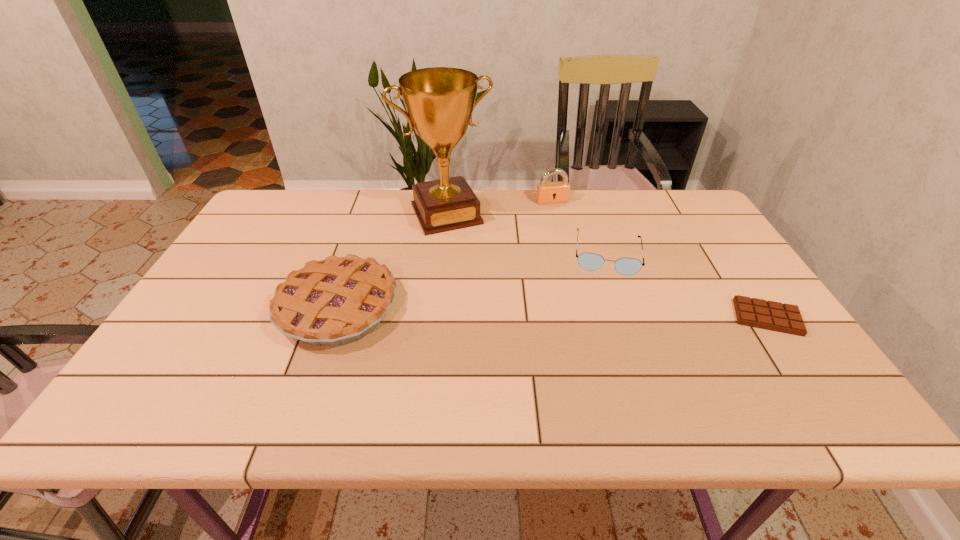
Locate an element on the screen. free spot on the desktop that is between the pie and the rightmost object and is positioned to unlock the fourth shortest object from the front is located at coordinates (608, 314).

The height and width of the screenshot is (540, 960). Find the location of `free space on the desktop that is between the pie and the shortest object and is positioned on the lenses of the spectacles`. free space on the desktop that is between the pie and the shortest object and is positioned on the lenses of the spectacles is located at coordinates (608, 314).

At what (x,y) coordinates should I click in order to perform the action: click on vacant space on the desktop that is between the pie and the candy bar and is positioned on the plaque of the tallest object. Please return your answer as a coordinate pair (x, y). The width and height of the screenshot is (960, 540). Looking at the image, I should click on (495, 311).